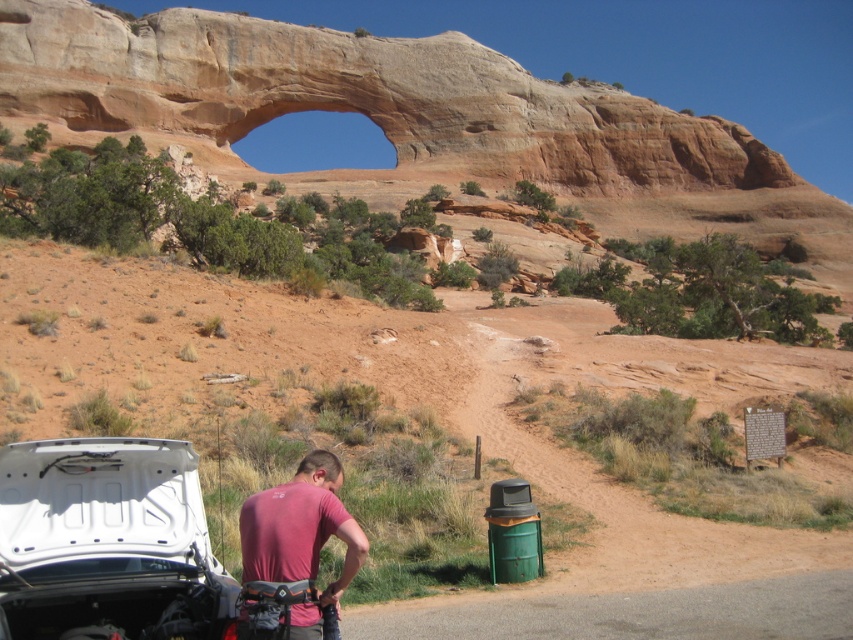
You are a hiker who just arrived at this desert location. You see the white matte car at lower left and the pink fabric shirt at lower center. Which object is closer to the left edge of the image?

The white matte car at lower left is positioned on the left side of the pink fabric shirt at lower center, so it is closer to the left edge of the image.

You are a hiker who just arrived at this desert location. You see the white matte car at lower left and the pink fabric shirt at lower center. Which object is closer to you?

The white matte car at lower left is closer to you because it is in front of the pink fabric shirt at lower center.

You are a hiker who needs to store your pink fabric shirt at lower center in the trunk of the white matte car at lower left. Based on their sizes, do you think the shirt will fit in the trunk?

The white matte car at lower left might be wider than pink fabric shirt at lower center, but without information about the shirt or car length or trunk space, it is uncertain if the shirt will fit.